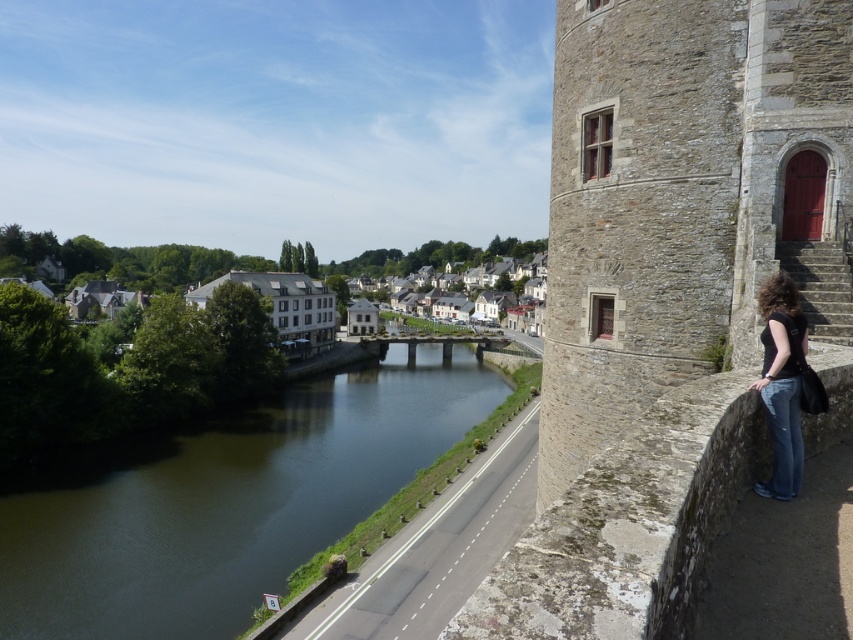
Question: Considering the real-world distances, which object is farthest from the black matte shirt at lower right?

Choices:
 (A) greenish-brown water at center
 (B) white stone buildings at center
 (C) white stone houses at center
 (D) stone tower at right

Answer: (C)

Question: Which point is farther from the camera taking this photo?

Choices:
 (A) (119, 464)
 (B) (689, 124)
 (C) (143, 275)
 (D) (407, 269)

Answer: (D)

Question: Can you confirm if stone tower at right is positioned above greenish-brown water at center?

Choices:
 (A) no
 (B) yes

Answer: (B)

Question: Which point is closer to the camera?

Choices:
 (A) (769, 396)
 (B) (267, 472)
 (C) (488, 250)
 (D) (659, 81)

Answer: (A)

Question: Observing the image, what is the correct spatial positioning of stone tower at right in reference to white stone buildings at center?

Choices:
 (A) left
 (B) right

Answer: (B)

Question: Is stone tower at right closer to camera compared to white stone houses at center?

Choices:
 (A) yes
 (B) no

Answer: (A)